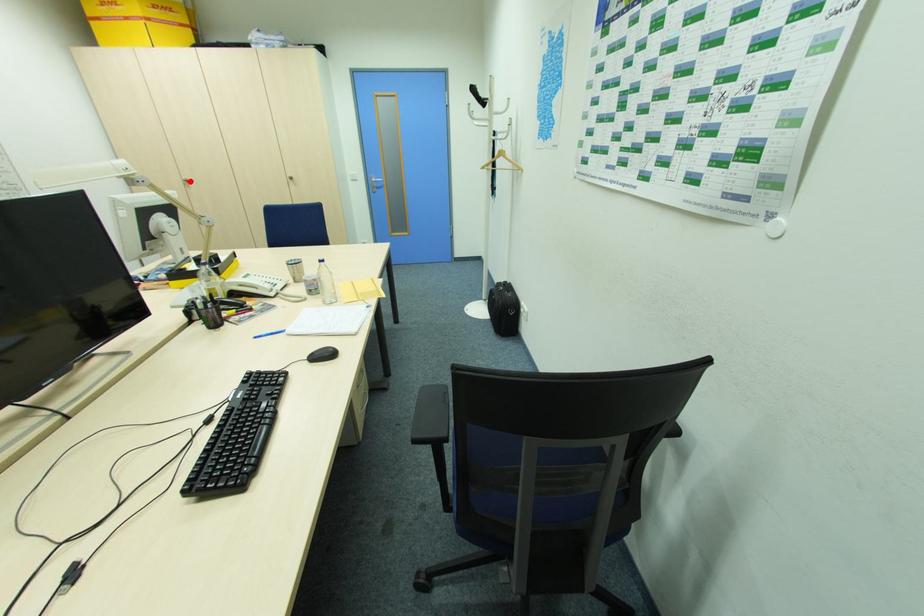
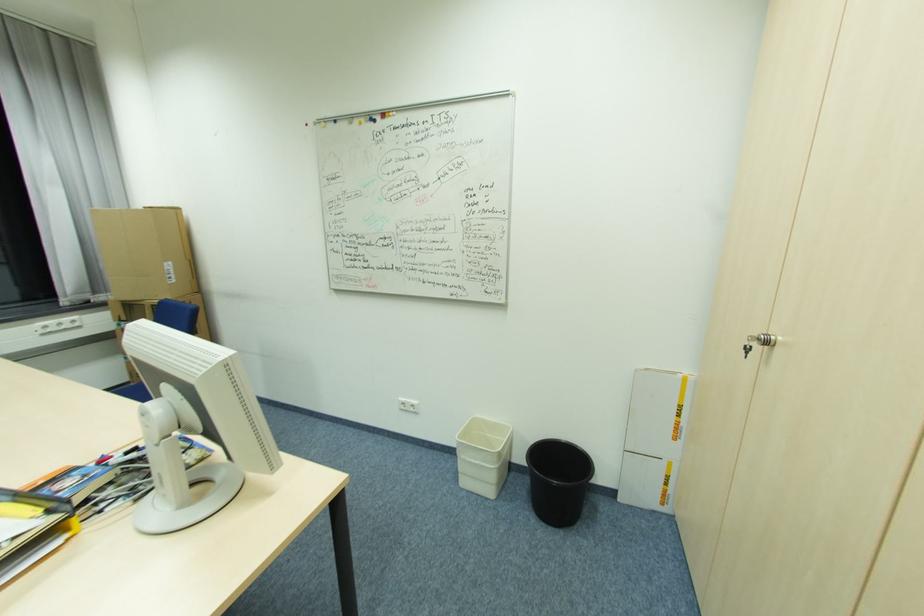
Where in the second image is the point corresponding to the highlighted location from the first image?

(772, 344)